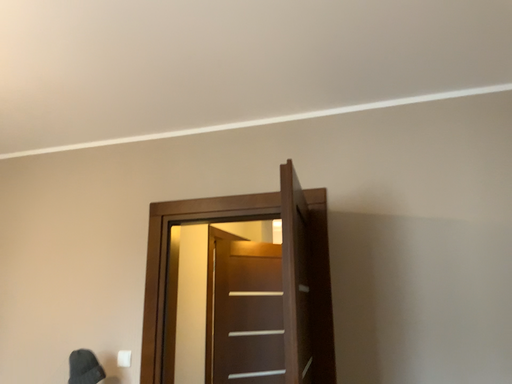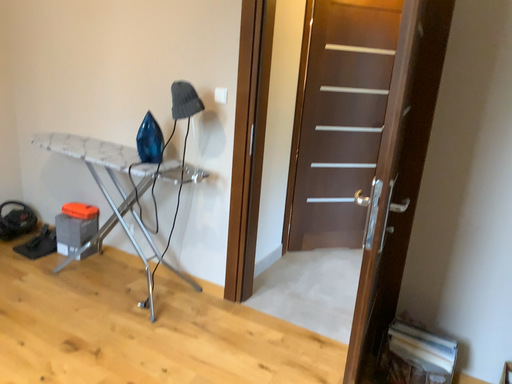
Question: How did the camera likely rotate when shooting the video?

Choices:
 (A) rotated right
 (B) rotated left

Answer: (B)